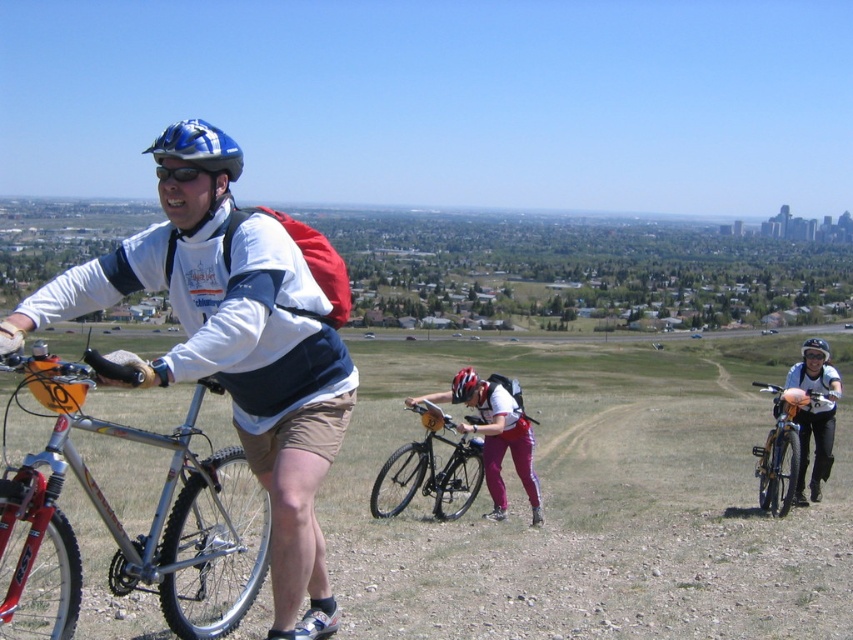
Question: Based on their relative distances, which object is nearer to the shiny black helmet at center?

Choices:
 (A) blue matte bicycle helmet at upper left
 (B) shiny black bicycle at center
 (C) matte black bicycle at right

Answer: (C)

Question: Which of these objects is positioned farthest from the matte black bicycle at right?

Choices:
 (A) silver metallic mountain bike at left
 (B) silver metallic bicycle at center
 (C) shiny black bicycle at center
 (D) blue matte bicycle helmet at upper left

Answer: (D)

Question: Can you confirm if silver metallic bicycle at center is smaller than shiny black helmet at center?

Choices:
 (A) no
 (B) yes

Answer: (B)

Question: Can you confirm if matte red helmet at center is bigger than shiny black helmet at center?

Choices:
 (A) no
 (B) yes

Answer: (A)

Question: Which point appears farthest from the camera in this image?

Choices:
 (A) (804, 353)
 (B) (474, 384)
 (C) (178, 426)
 (D) (775, 433)

Answer: (C)

Question: Does shiny black bicycle at center appear on the right side of blue matte bicycle helmet at upper left?

Choices:
 (A) yes
 (B) no

Answer: (A)